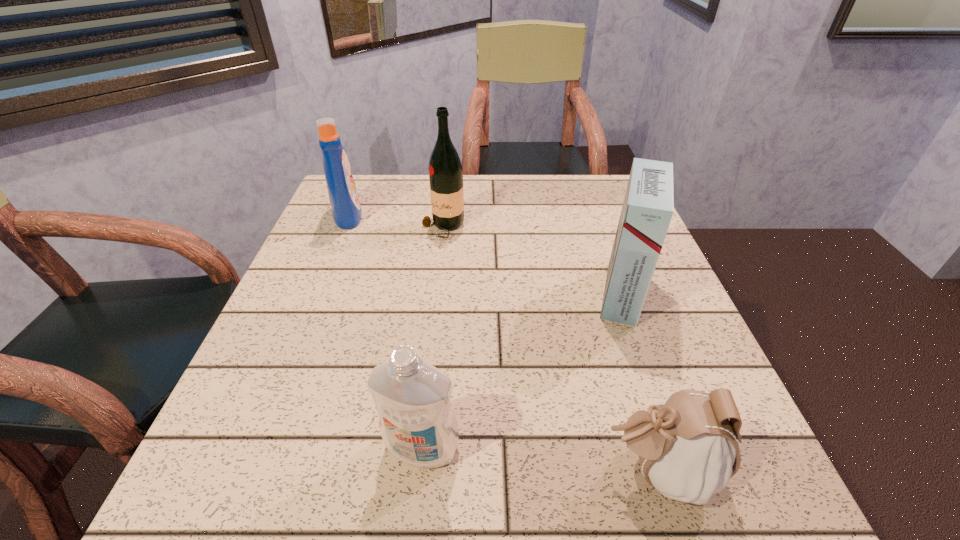
At what (x,y) coordinates should I click in order to perform the action: click on pouch positioned at the right edge. Please return your answer as a coordinate pair (x, y). The height and width of the screenshot is (540, 960). Looking at the image, I should click on (687, 446).

Where is `object at the far left corner`? object at the far left corner is located at coordinates (346, 211).

What are the coordinates of `object that is at the near right corner` in the screenshot? It's located at (687, 446).

In the image, there is a desktop. In order to click on vacant space at the far edge in this screenshot , I will do `click(559, 185)`.

This screenshot has width=960, height=540. I want to click on vacant region at the near edge of the desktop, so click(488, 518).

Image resolution: width=960 pixels, height=540 pixels. What are the coordinates of `vacant region at the left edge of the desktop` in the screenshot? It's located at (300, 326).

Locate an element on the screen. vacant space at the far left corner is located at coordinates [x=361, y=176].

Where is `vacant area at the far right corner`? The image size is (960, 540). vacant area at the far right corner is located at coordinates (576, 215).

Where is `free space that is in between the wine bottle and the left detergent`? The width and height of the screenshot is (960, 540). free space that is in between the wine bottle and the left detergent is located at coordinates (396, 221).

This screenshot has height=540, width=960. What are the coordinates of `vacant area that lies between the leftmost object and the shortest object` in the screenshot? It's located at (503, 343).